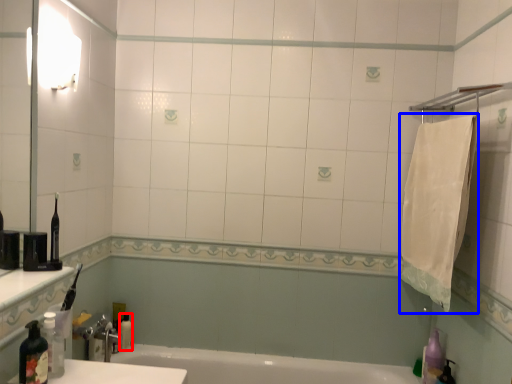
Question: Which point is closer to the camera, toiletry (highlighted by a red box) or bath towel (highlighted by a blue box)?

Choices:
 (A) toiletry
 (B) bath towel

Answer: (B)